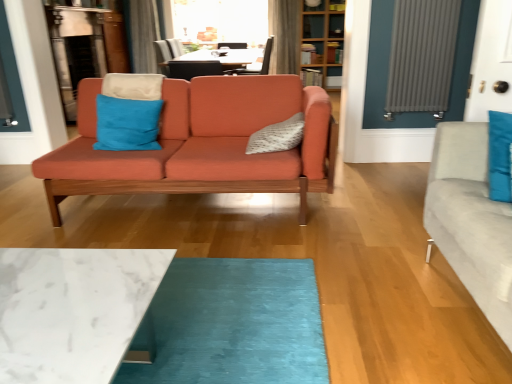
Question: Should I look upward or downward to see transparent glass window screen at upper center?

Choices:
 (A) down
 (B) up

Answer: (B)

Question: Is matte orange couch at center at the back of velvet gray curtain at upper center, the first curtain viewed from the right?

Choices:
 (A) yes
 (B) no

Answer: (B)

Question: Is velvet gray curtain at upper center, arranged as the second curtain when viewed from the left, shorter than matte orange couch at center?

Choices:
 (A) no
 (B) yes

Answer: (A)

Question: Does velvet gray curtain at upper center, the first curtain viewed from the right, have a lesser width compared to matte orange couch at center?

Choices:
 (A) no
 (B) yes

Answer: (B)

Question: Is velvet gray curtain at upper center, arranged as the second curtain when viewed from the left, smaller than matte orange couch at center?

Choices:
 (A) no
 (B) yes

Answer: (B)

Question: Can you confirm if velvet gray curtain at upper center, arranged as the second curtain when viewed from the left, is bigger than matte orange couch at center?

Choices:
 (A) no
 (B) yes

Answer: (A)

Question: Would you say velvet gray curtain at upper center, arranged as the second curtain when viewed from the left, contains matte orange couch at center?

Choices:
 (A) yes
 (B) no

Answer: (B)

Question: Is wooden bookshelf at upper center taller than matte black chair at upper center?

Choices:
 (A) no
 (B) yes

Answer: (B)

Question: Does wooden bookshelf at upper center have a lesser width compared to matte black chair at upper center?

Choices:
 (A) no
 (B) yes

Answer: (B)

Question: From a real-world perspective, is wooden bookshelf at upper center on top of matte black chair at upper center?

Choices:
 (A) no
 (B) yes

Answer: (B)

Question: Considering the relative positions of wooden bookshelf at upper center and matte black chair at upper center in the image provided, is wooden bookshelf at upper center to the left of matte black chair at upper center from the viewer's perspective?

Choices:
 (A) no
 (B) yes

Answer: (A)

Question: Is the position of wooden bookshelf at upper center more distant than that of matte black chair at upper center?

Choices:
 (A) yes
 (B) no

Answer: (A)

Question: From the image's perspective, is wooden bookshelf at upper center located above matte black chair at upper center?

Choices:
 (A) yes
 (B) no

Answer: (A)

Question: Is blue suede pillow at center, arranged as the 2th pillow when viewed from the right, oriented towards silky gray curtain at upper center, which is the second curtain in right-to-left order?

Choices:
 (A) yes
 (B) no

Answer: (B)